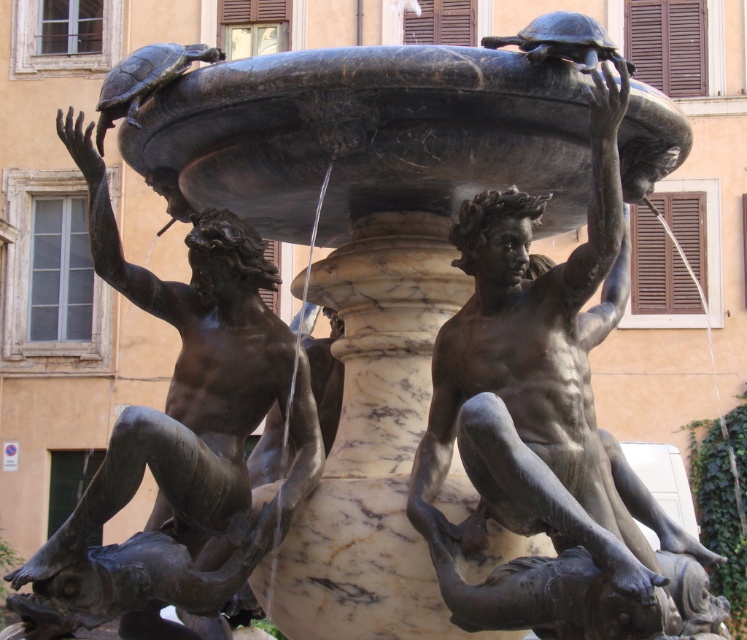
You are standing at the entrance of the park and want to locate the bronze statue at center. According to the coordinates provided, in which direction should you walk from your current position to reach it?

The bronze statue at center is located at coordinates point (542, 413). Since the y coordinate is 0.727, which is closer to 1, you should walk forward to reach it.

You are standing in front of the fountain and want to take a photo of both the bronze statue at center and the bronze statue at left. Which statue should you position closer to the camera to ensure both are fully visible in the frame?

You should position the bronze statue at center closer to the camera since it is in front of the bronze statue at left, ensuring both are visible without one blocking the other.